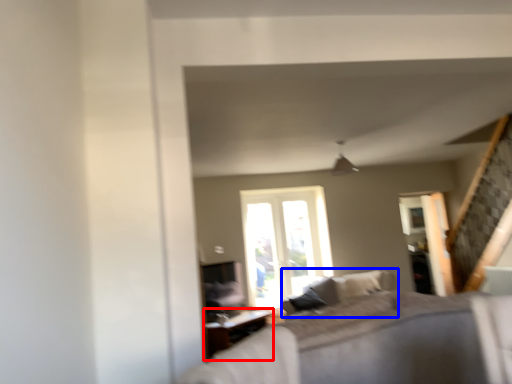
Question: Among these objects, which one is nearest to the camera, table (highlighted by a red box) or couch (highlighted by a blue box)?

Choices:
 (A) table
 (B) couch

Answer: (B)